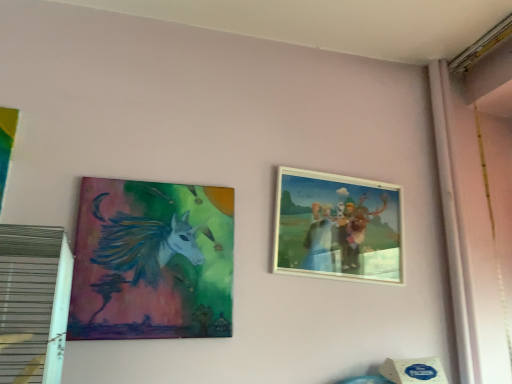
Question: Choose the correct answer: Is wooden picture frame at upper right, arranged as the second picture frame when viewed from the left, inside matte acrylic painting of unicorn at left, which appears as the second picture frame when viewed from the right, or outside it?

Choices:
 (A) outside
 (B) inside

Answer: (A)

Question: From a real-world perspective, is wooden picture frame at upper right, arranged as the second picture frame when viewed from the left, above or below matte acrylic painting of unicorn at left, the 1th picture frame viewed from the left?

Choices:
 (A) above
 (B) below

Answer: (A)

Question: From their relative heights in the image, would you say wooden picture frame at upper right, arranged as the second picture frame when viewed from the left, is taller or shorter than matte acrylic painting of unicorn at left, the 1th picture frame viewed from the left?

Choices:
 (A) tall
 (B) short

Answer: (B)

Question: Would you say matte acrylic painting of unicorn at left, the 1th picture frame viewed from the left, is to the left or to the right of wooden picture frame at upper right, the first picture frame positioned from the right, in the picture?

Choices:
 (A) left
 (B) right

Answer: (A)

Question: From a real-world perspective, is matte acrylic painting of unicorn at left, the 1th picture frame viewed from the left, above or below wooden picture frame at upper right, arranged as the second picture frame when viewed from the left?

Choices:
 (A) above
 (B) below

Answer: (B)

Question: Is matte acrylic painting of unicorn at left, which appears as the second picture frame when viewed from the right, inside or outside of wooden picture frame at upper right, the first picture frame positioned from the right?

Choices:
 (A) inside
 (B) outside

Answer: (B)

Question: Is point (138, 215) closer or farther from the camera than point (278, 180)?

Choices:
 (A) closer
 (B) farther

Answer: (A)